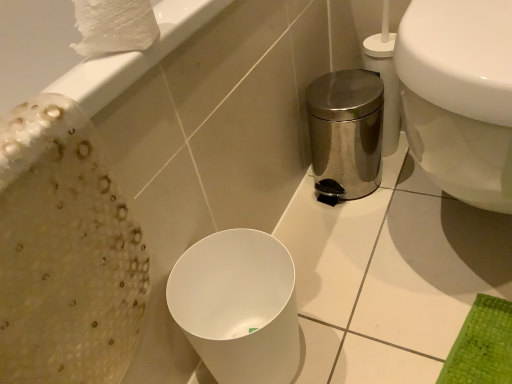
Question: Is white textured toilet paper at upper left positioned behind white glossy toilet at right?

Choices:
 (A) no
 (B) yes

Answer: (B)

Question: Could white glossy toilet at right be considered to be inside white textured toilet paper at upper left?

Choices:
 (A) no
 (B) yes

Answer: (A)

Question: From the image's perspective, is white textured toilet paper at upper left located above white glossy toilet at right?

Choices:
 (A) yes
 (B) no

Answer: (A)

Question: Is white textured toilet paper at upper left taller than white glossy toilet at right?

Choices:
 (A) no
 (B) yes

Answer: (A)

Question: Does white textured toilet paper at upper left have a smaller size compared to white glossy toilet at right?

Choices:
 (A) yes
 (B) no

Answer: (A)

Question: From a real-world perspective, does white textured toilet paper at upper left sit lower than white glossy toilet at right?

Choices:
 (A) yes
 (B) no

Answer: (B)

Question: From a real-world perspective, is white textured toilet paper at upper left on top of white matte bidet at center?

Choices:
 (A) yes
 (B) no

Answer: (A)

Question: Is white textured toilet paper at upper left wider than white matte bidet at center?

Choices:
 (A) no
 (B) yes

Answer: (A)

Question: Does white textured toilet paper at upper left appear on the right side of white matte bidet at center?

Choices:
 (A) no
 (B) yes

Answer: (A)

Question: Does white textured toilet paper at upper left have a lesser width compared to white matte bidet at center?

Choices:
 (A) no
 (B) yes

Answer: (B)

Question: From the image's perspective, is white textured toilet paper at upper left beneath white matte bidet at center?

Choices:
 (A) no
 (B) yes

Answer: (A)

Question: Is white textured toilet paper at upper left positioned in front of white matte bidet at center?

Choices:
 (A) yes
 (B) no

Answer: (A)

Question: Can you confirm if white matte bidet at center is bigger than white glossy toilet at right?

Choices:
 (A) yes
 (B) no

Answer: (B)